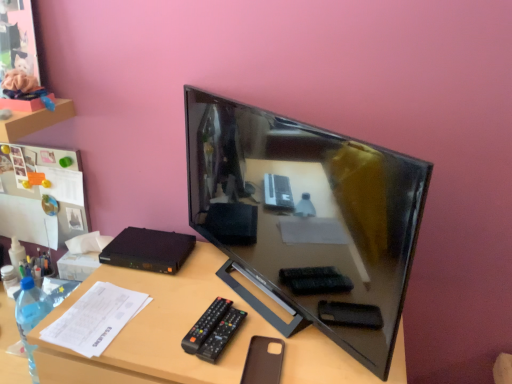
The image size is (512, 384). I want to click on vacant space that is in between black glossy television at center and brown leather phone case at lower center, so click(x=236, y=312).